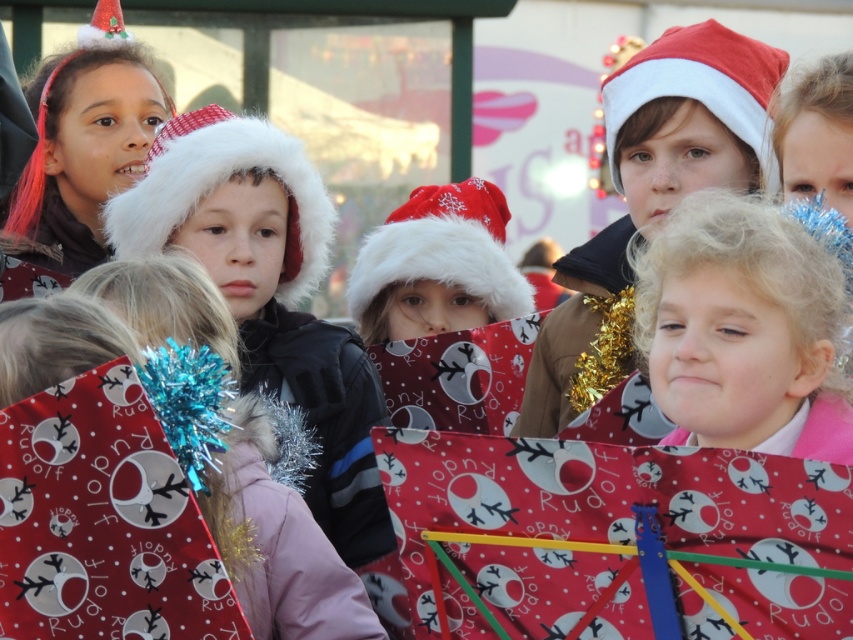
Does blonde curly hair at center have a greater height compared to white fluffy santa hat at center?

No, blonde curly hair at center is not taller than white fluffy santa hat at center.

The height and width of the screenshot is (640, 853). Describe the element at coordinates (747, 324) in the screenshot. I see `blonde curly hair at center` at that location.

Does point (755, 204) come behind point (210, 176)?

No, it is in front of (210, 176).

This screenshot has width=853, height=640. I want to click on blonde curly hair at center, so click(747, 324).

Can you confirm if red fluffy santa hat at center is positioned to the left of red matte santa hat at upper center?

Indeed, red fluffy santa hat at center is positioned on the left side of red matte santa hat at upper center.

Find the location of a particular element. red fluffy santa hat at center is located at coordinates (444, 250).

Which is more to the left, red shiny wrapping paper at center or red matte santa hat at upper center?

Positioned to the left is red shiny wrapping paper at center.

The image size is (853, 640). What do you see at coordinates (103, 520) in the screenshot?
I see `red shiny wrapping paper at center` at bounding box center [103, 520].

Identify the location of red shiny wrapping paper at center. point(103,520).